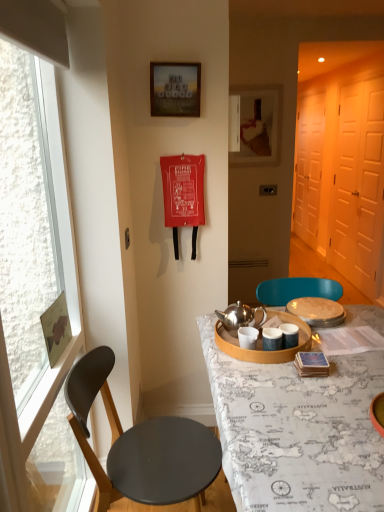
Identify the location of white matte coffee cup at center. The image size is (384, 512). (248, 337).

What do you see at coordinates (359, 186) in the screenshot?
I see `white matte door at right, arranged as the first screen door when viewed from the front` at bounding box center [359, 186].

Identify the location of white matte coffee cup at center. click(x=248, y=337).

Is wooden frame at upper center, the 2th picture frame in the right-to-left sequence, far from silver metallic teapot at center, which is counted as the first tableware, starting from the left?

Yes, wooden frame at upper center, the 2th picture frame in the right-to-left sequence, is far from silver metallic teapot at center, which is counted as the first tableware, starting from the left.

From the image's perspective, is wooden frame at upper center, the 1th picture frame in the front-to-back sequence, beneath silver metallic teapot at center, which is counted as the first tableware, starting from the left?

No, from the image's perspective, wooden frame at upper center, the 1th picture frame in the front-to-back sequence, is not below silver metallic teapot at center, which is counted as the first tableware, starting from the left.

From a real-world perspective, who is located higher, wooden frame at upper center, the 1th picture frame in the front-to-back sequence, or silver metallic teapot at center, the 2th tableware from the right?

wooden frame at upper center, the 1th picture frame in the front-to-back sequence.

Is point (198, 114) closer or farther from the camera than point (285, 319)?

Point (198, 114) appears to be farther away from the viewer than point (285, 319).

Is point (159, 93) closer to viewer compared to point (244, 329)?

No, (159, 93) is behind (244, 329).

Starting from the white matte coffee cup at center, which picture frame is the 1st one behind? Please provide its 2D coordinates.

[(175, 89)]

In the scene shown: Considering the sizes of objects wooden frame at upper center, the 1th picture frame in the left-to-right sequence, and white matte coffee cup at center in the image provided, who is shorter, wooden frame at upper center, the 1th picture frame in the left-to-right sequence, or white matte coffee cup at center?

white matte coffee cup at center is shorter.

In the image, is wooden frame at upper center, the 2th picture frame in the right-to-left sequence, on the left side or the right side of white matte coffee cup at center?

In the image, wooden frame at upper center, the 2th picture frame in the right-to-left sequence, appears on the left side of white matte coffee cup at center.

Is wooden picture frame at upper center, which ranks as the first picture frame in back-to-front order, to the left of matte silver tray at center, which is the 2th tableware in left-to-right order, from the viewer's perspective?

Yes, wooden picture frame at upper center, which ranks as the first picture frame in back-to-front order, is to the left of matte silver tray at center, which is the 2th tableware in left-to-right order.

Are wooden picture frame at upper center, which is counted as the 1th picture frame, starting from the right, and matte silver tray at center, which ranks as the 1th tableware in right-to-left order, making contact?

No, wooden picture frame at upper center, which is counted as the 1th picture frame, starting from the right, is not beside matte silver tray at center, which ranks as the 1th tableware in right-to-left order.

Considering the positions of point (234, 104) and point (332, 314), is point (234, 104) closer or farther from the camera than point (332, 314)?

Point (234, 104).

Is wooden picture frame at upper center, the second picture frame in the front-to-back sequence, closer to the viewer compared to matte silver tray at center, which ranks as the 1th tableware in right-to-left order?

No, wooden picture frame at upper center, the second picture frame in the front-to-back sequence, is further to the viewer.

You are a GUI agent. You are given a task and a screenshot of the screen. Output one action in this format:
    pyautogui.click(x=<x>, y=<y>)
    Task: Click on the desk below the silver metallic teapot at center, which is counted as the first tableware, starting from the left (from a real-world perspective)
    This screenshot has width=384, height=512.
    Given the screenshot: What is the action you would take?
    pyautogui.click(x=297, y=431)

From the picture: Considering the positions of objects silver metallic teapot at center, which is counted as the first tableware, starting from the left, and map-covered table at center in the image provided, who is more to the left, silver metallic teapot at center, which is counted as the first tableware, starting from the left, or map-covered table at center?

From the viewer's perspective, silver metallic teapot at center, which is counted as the first tableware, starting from the left, appears more on the left side.

Is silver metallic teapot at center, which is counted as the first tableware, starting from the left, positioned before map-covered table at center?

No, it is behind map-covered table at center.

From a real-world perspective, between silver metallic teapot at center, the 2th tableware from the right, and map-covered table at center, who is vertically higher?

silver metallic teapot at center, the 2th tableware from the right, is physically above.

Are map-covered table at center and clear glass window at left located far from each other?

map-covered table at center is near clear glass window at left, not far away.

Considering the sizes of objects map-covered table at center and clear glass window at left in the image provided, who is bigger, map-covered table at center or clear glass window at left?

With larger size is map-covered table at center.

Considering the sizes of map-covered table at center and clear glass window at left in the image, is map-covered table at center wider or thinner than clear glass window at left?

In the image, map-covered table at center appears to be wider than clear glass window at left.

Are white matte screen door at right, placed as the 2th screen door when sorted from front to back, and white matte door at right, which is counted as the 2th screen door, starting from the back, far apart?

white matte screen door at right, placed as the 2th screen door when sorted from front to back, is near white matte door at right, which is counted as the 2th screen door, starting from the back, not far away.

Identify the location of screen door on the left of white matte door at right, which is counted as the 2th screen door, starting from the back. The image size is (384, 512). (309, 166).

From the image's perspective, is white matte coffee cup at center above or below white matte door at right, arranged as the first screen door when viewed from the front?

Based on their image positions, white matte coffee cup at center is located beneath white matte door at right, arranged as the first screen door when viewed from the front.

From a real-world perspective, is white matte coffee cup at center beneath white matte door at right, which is counted as the 2th screen door, starting from the back?

Yes.

In terms of size, does white matte coffee cup at center appear bigger or smaller than white matte door at right, arranged as the first screen door when viewed from the front?

Considering their sizes, white matte coffee cup at center takes up less space than white matte door at right, arranged as the first screen door when viewed from the front.

Identify the location of the 2nd tableware in front of the wooden frame at upper center, the second picture frame from the back. Image resolution: width=384 pixels, height=512 pixels. (262, 344).

Locate an element on the screen. The image size is (384, 512). coffee cup below the wooden frame at upper center, the 1th picture frame in the front-to-back sequence (from a real-world perspective) is located at coordinates (248, 337).

Estimate the real-world distances between objects in this image. Which object is further from matte silver tray at center, which ranks as the 1th tableware in right-to-left order, black matte chair at left or white matte screen door at right, the 1th screen door when ordered from back to front?

The object further to matte silver tray at center, which ranks as the 1th tableware in right-to-left order, is white matte screen door at right, the 1th screen door when ordered from back to front.

Based on the photo, when comparing their distances from clear glass window at left, does map-covered table at center or black matte chair at left seem further?

map-covered table at center is further to clear glass window at left.

Which object lies nearer to the anchor point white matte door at right, arranged as the first screen door when viewed from the front, white matte screen door at right, placed as the 2th screen door when sorted from front to back, or clear glass window at left?

white matte screen door at right, placed as the 2th screen door when sorted from front to back, is closer to white matte door at right, arranged as the first screen door when viewed from the front.

Looking at the image, which one is located closer to map-covered table at center, wooden frame at upper center, the 1th picture frame in the front-to-back sequence, or matte silver tray at center, which is the 2th tableware in left-to-right order?

Based on the image, matte silver tray at center, which is the 2th tableware in left-to-right order, appears to be nearer to map-covered table at center.

Which object lies nearer to the anchor point silver metallic teapot at center, the 2th tableware from the right, wooden frame at upper center, the 2th picture frame in the right-to-left sequence, or clear glass window at left?

clear glass window at left.

Which object lies further to the anchor point wooden picture frame at upper center, which is counted as the 1th picture frame, starting from the right, map-covered table at center or clear glass window at left?

Among the two, map-covered table at center is located further to wooden picture frame at upper center, which is counted as the 1th picture frame, starting from the right.

Considering their positions, is white matte screen door at right, placed as the 2th screen door when sorted from front to back, positioned closer to map-covered table at center than black matte chair at left?

black matte chair at left.

From the picture: Looking at the image, which one is located closer to black matte chair at left, matte silver tray at center, which is the 2th tableware in left-to-right order, or white matte coffee cup at center?

Based on the image, white matte coffee cup at center appears to be nearer to black matte chair at left.

You are a GUI agent. You are given a task and a screenshot of the screen. Output one action in this format:
    pyautogui.click(x=<x>, y=<y>)
    Task: Click on the tableware located between map-covered table at center and white matte coffee cup at center in the depth direction
    
    Given the screenshot: What is the action you would take?
    pyautogui.click(x=262, y=344)

The image size is (384, 512). Find the location of `coffee cup between black matte chair at left and matte silver tray at center, which ranks as the 1th tableware in right-to-left order`. coffee cup between black matte chair at left and matte silver tray at center, which ranks as the 1th tableware in right-to-left order is located at coordinates (248, 337).

At what (x,y) coordinates should I click in order to perform the action: click on coffee cup situated between black matte chair at left and map-covered table at center from left to right. Please return your answer as a coordinate pair (x, y). This screenshot has width=384, height=512. Looking at the image, I should click on 248,337.

The height and width of the screenshot is (512, 384). Identify the location of chair located between clear glass window at left and white matte coffee cup at center in the depth direction. (141, 448).